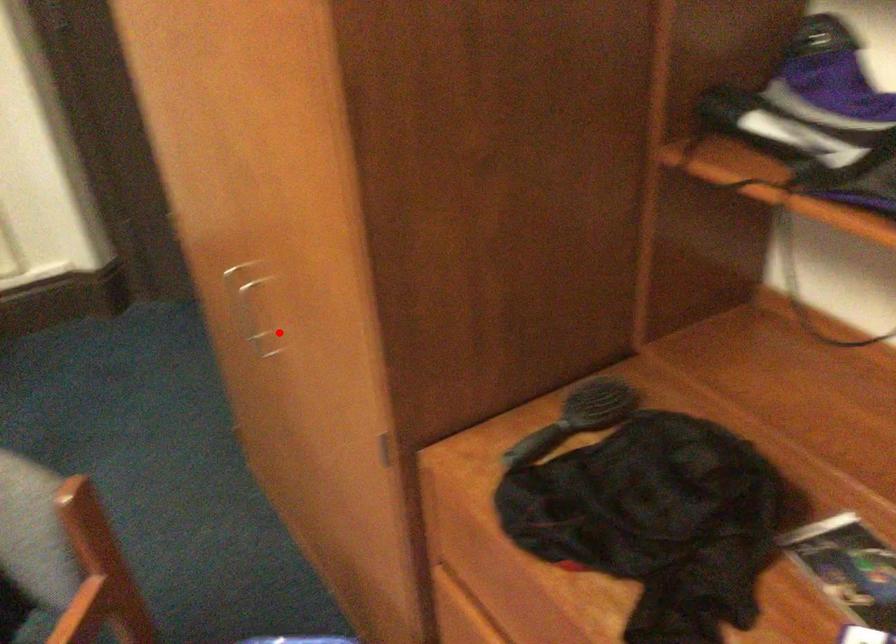
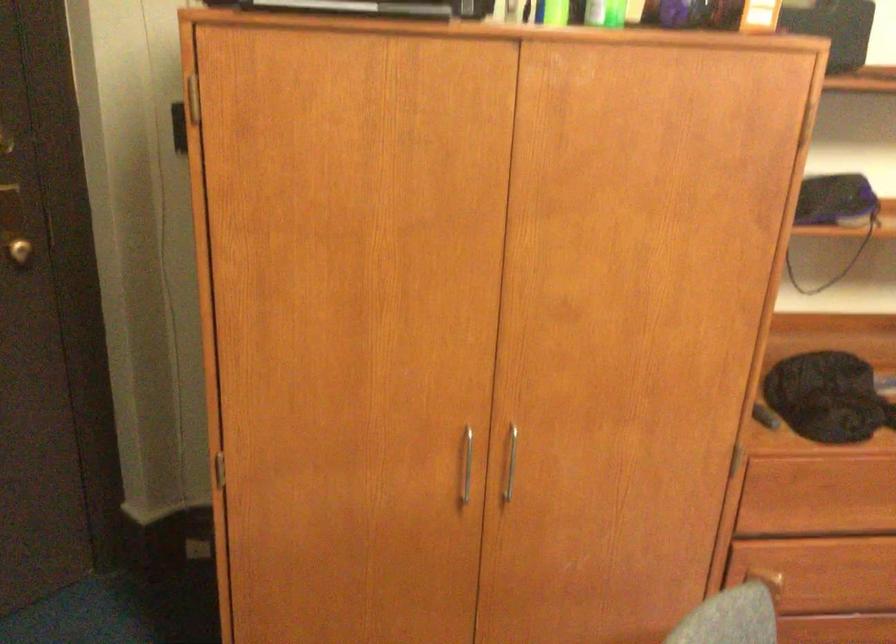
The point at the highlighted location is marked in the first image. Where is the corresponding point in the second image?

(511, 462)